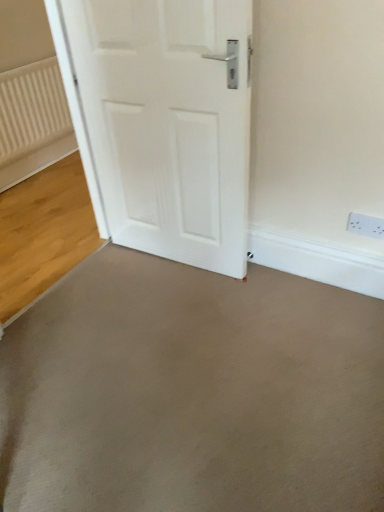
I want to click on free region under white matte door at center (from a real-world perspective), so click(x=169, y=262).